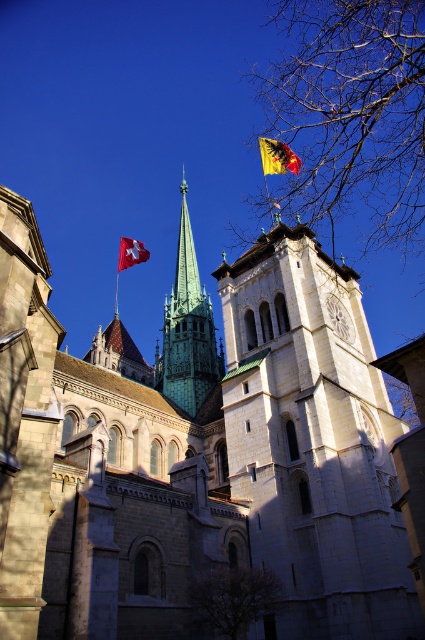
Question: Is white stone tower at center thinner than bare branches at lower center?

Choices:
 (A) yes
 (B) no

Answer: (B)

Question: Which object appears farthest from the camera in this image?

Choices:
 (A) white stone tower at center
 (B) swiss flag at upper left

Answer: (B)

Question: Which of these objects is positioned closest to the green copper spire at upper center?

Choices:
 (A) bare branches at upper center
 (B) green copper spire at center
 (C) white stone tower at center

Answer: (C)

Question: Among these points, which one is farthest from the camera?

Choices:
 (A) tap(283, 428)
 (B) tap(377, 106)

Answer: (A)

Question: Does bare branches at upper center have a smaller size compared to green copper spire at center?

Choices:
 (A) no
 (B) yes

Answer: (A)

Question: Is green copper spire at upper center positioned in front of green copper spire at center?

Choices:
 (A) no
 (B) yes

Answer: (B)